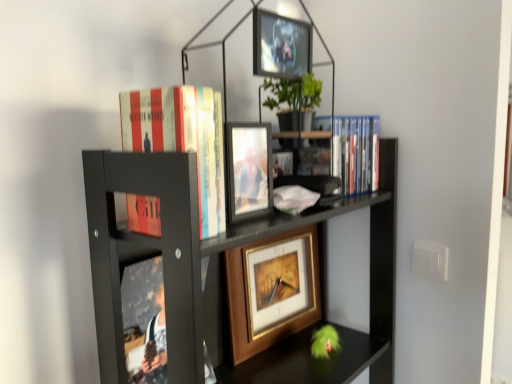
Question: Considering the relative sizes of black matte bookcase at upper center and matte glass photo frame at center, positioned as the 3th picture frame in back-to-front order, in the image provided, is black matte bookcase at upper center thinner than matte glass photo frame at center, positioned as the 3th picture frame in back-to-front order,?

Choices:
 (A) no
 (B) yes

Answer: (A)

Question: Considering the relative positions of black matte bookcase at upper center and matte glass photo frame at center, positioned as the 3th picture frame in back-to-front order, in the image provided, is black matte bookcase at upper center to the right of matte glass photo frame at center, positioned as the 3th picture frame in back-to-front order, from the viewer's perspective?

Choices:
 (A) yes
 (B) no

Answer: (A)

Question: Is black matte bookcase at upper center with matte glass photo frame at center, the second picture frame when ordered from top to bottom?

Choices:
 (A) no
 (B) yes

Answer: (A)

Question: Is black matte bookcase at upper center bigger than matte glass photo frame at center, which is the 1th picture frame in front-to-back order?

Choices:
 (A) no
 (B) yes

Answer: (B)

Question: Is black matte bookcase at upper center not close to matte glass photo frame at center, the second picture frame when ordered from top to bottom?

Choices:
 (A) yes
 (B) no

Answer: (B)

Question: From a real-world perspective, is gold-framed picture at center, the 3th picture frame in the front-to-back sequence, above or below hardcover book at upper center, which is the 1th book in front-to-back order?

Choices:
 (A) below
 (B) above

Answer: (A)

Question: Based on their positions, is gold-framed picture at center, the 3th picture frame in the front-to-back sequence, located to the left or right of hardcover book at upper center, which ranks as the 1th book in left-to-right order?

Choices:
 (A) right
 (B) left

Answer: (A)

Question: Does point (288, 286) appear closer or farther from the camera than point (164, 132)?

Choices:
 (A) farther
 (B) closer

Answer: (A)

Question: From the image's perspective, is gold-framed picture at center, marked as the 1th picture frame in a back-to-front arrangement, positioned above or below hardcover book at upper center, which is the 1th book in front-to-back order?

Choices:
 (A) above
 (B) below

Answer: (B)

Question: In the image, is black matte bookcase at upper center on the left side or the right side of blue plastic dvds at upper right, which is the second book from left to right?

Choices:
 (A) right
 (B) left

Answer: (B)

Question: In terms of width, does black matte bookcase at upper center look wider or thinner when compared to blue plastic dvds at upper right, which is the second book from left to right?

Choices:
 (A) thin
 (B) wide

Answer: (B)

Question: Considering the positions of black matte bookcase at upper center and blue plastic dvds at upper right, marked as the first book in a right-to-left arrangement, in the image, is black matte bookcase at upper center bigger or smaller than blue plastic dvds at upper right, marked as the first book in a right-to-left arrangement,?

Choices:
 (A) small
 (B) big

Answer: (B)

Question: From their relative heights in the image, would you say black matte bookcase at upper center is taller or shorter than blue plastic dvds at upper right, placed as the second book when sorted from front to back?

Choices:
 (A) short
 (B) tall

Answer: (B)

Question: Is blue plastic dvds at upper right, placed as the first book when sorted from back to front, wider or thinner than hardcover book at upper center, which ranks as the 1th book in left-to-right order?

Choices:
 (A) wide
 (B) thin

Answer: (B)

Question: Based on their positions, is blue plastic dvds at upper right, placed as the first book when sorted from back to front, located to the left or right of hardcover book at upper center, the 2th book viewed from the right?

Choices:
 (A) right
 (B) left

Answer: (A)